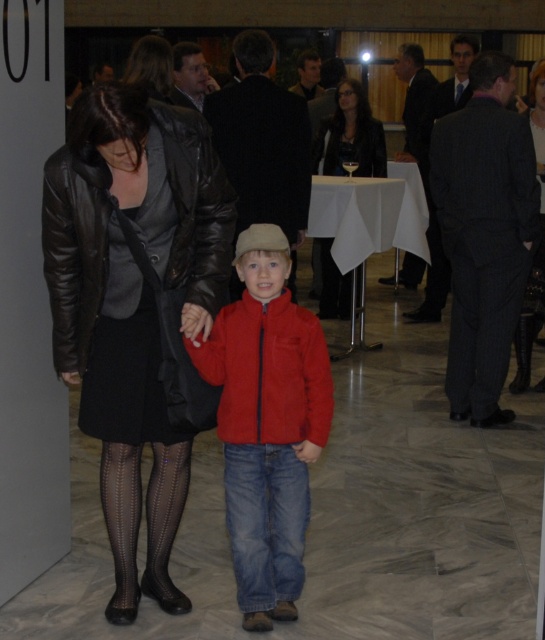
Question: Is leather jacket at center in front of matte black dress at center?

Choices:
 (A) yes
 (B) no

Answer: (A)

Question: Estimate the real-world distances between objects in this image. Which object is farther from the matte black jacket at center?

Choices:
 (A) matte red jacket at center
 (B) black mesh tights at lower left
 (C) matte black dress at center
 (D) red fleece jacket at center

Answer: (B)

Question: Which point is farther to the camera?

Choices:
 (A) denim jeans at center
 (B) matte black dress at center
 (C) red fleece jacket at center
 (D) leather jacket at center

Answer: (B)

Question: From the image, what is the correct spatial relationship of leather jacket at center in relation to matte red jacket at center?

Choices:
 (A) right
 (B) left

Answer: (B)

Question: Is matte black jacket at center to the right of matte black dress at center from the viewer's perspective?

Choices:
 (A) yes
 (B) no

Answer: (B)

Question: Which object is the farthest from the denim jeans at center?

Choices:
 (A) red fleece jacket at center
 (B) matte red jacket at center

Answer: (B)